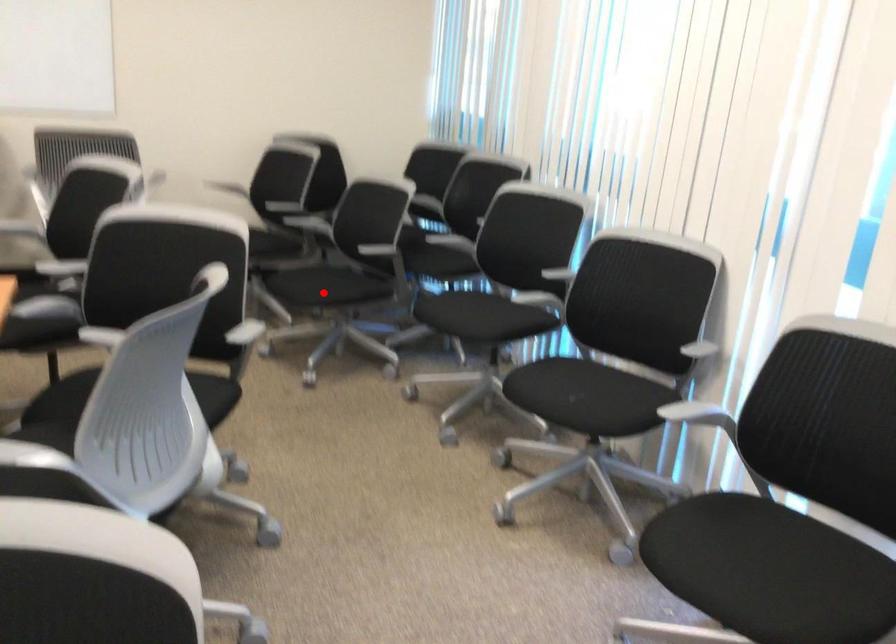
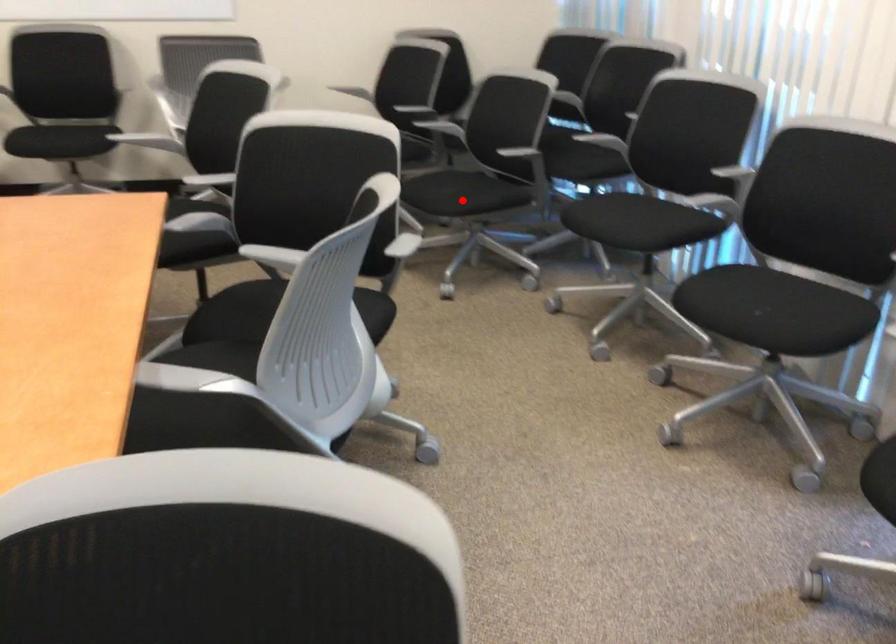
I am providing you with two images of the same scene from different viewpoints. A red point is marked on the first image and another point is marked on the second image. Does the point marked in image1 correspond to the same location as the one in image2?

Yes